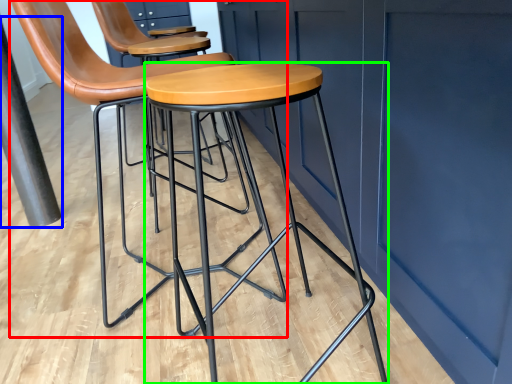
Question: Based on their relative distances, which object is nearer to chair (highlighted by a red box)? Choose from pole (highlighted by a blue box) and stool (highlighted by a green box).

Choices:
 (A) pole
 (B) stool

Answer: (B)